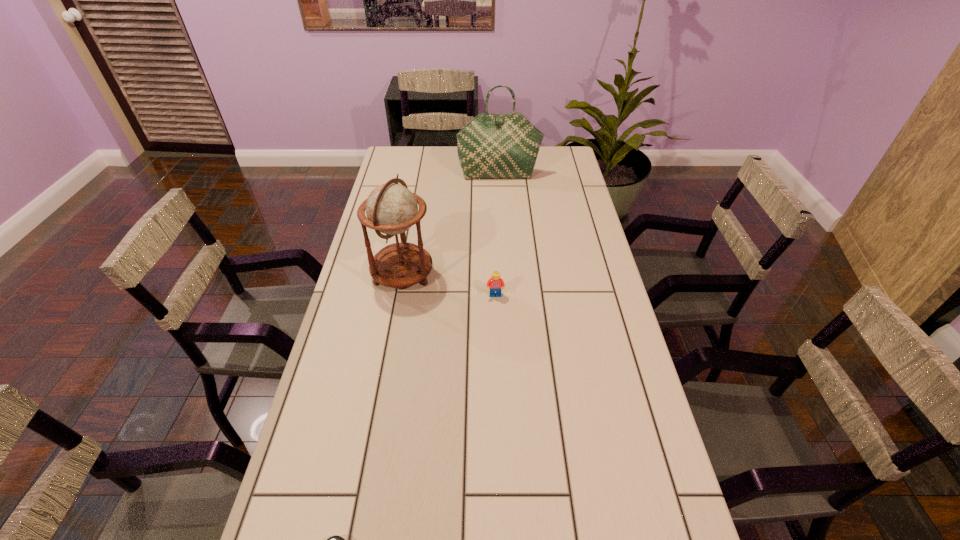
This screenshot has height=540, width=960. In order to click on the farthest object in this screenshot , I will do `click(491, 146)`.

At what (x,y) coordinates should I click in order to perform the action: click on globe. Please return your answer as a coordinate pair (x, y). Image resolution: width=960 pixels, height=540 pixels. Looking at the image, I should click on (391, 208).

The width and height of the screenshot is (960, 540). I want to click on the second shortest object, so click(x=495, y=283).

Image resolution: width=960 pixels, height=540 pixels. I want to click on vacant space situated 0.180m on the back of the tote bag, so click(497, 148).

The image size is (960, 540). In order to click on free space located on the surface of the globe in this screenshot , I will do point(524,275).

What are the coordinates of `free spot located 0.280m on the face of the third tallest object` in the screenshot? It's located at (498, 380).

What are the coordinates of `object that is positioned at the far edge` in the screenshot? It's located at (491, 146).

This screenshot has height=540, width=960. I want to click on object that is positioned at the left edge, so click(x=391, y=208).

Locate an element on the screen. The height and width of the screenshot is (540, 960). object that is at the right edge is located at coordinates (491, 146).

You are a GUI agent. You are given a task and a screenshot of the screen. Output one action in this format:
    pyautogui.click(x=<x>, y=<y>)
    Task: Click on the object present at the far right corner
    
    Given the screenshot: What is the action you would take?
    pyautogui.click(x=491, y=146)